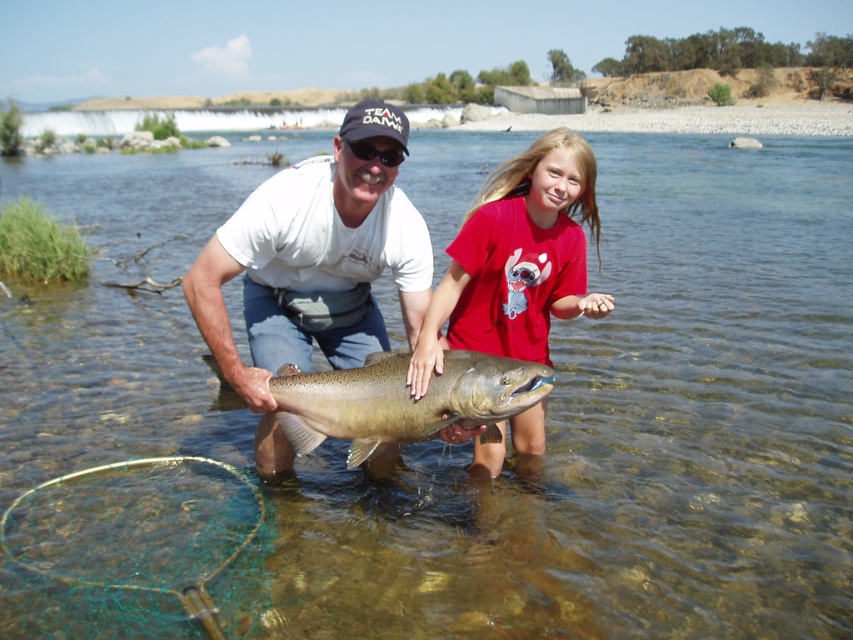
Does matte white shirt at center have a greater height compared to shiny silver fish at center?

Indeed, matte white shirt at center has a greater height compared to shiny silver fish at center.

Is matte white shirt at center positioned behind shiny silver fish at center?

Yes, matte white shirt at center is further from the viewer.

Does point (378, 323) come closer to viewer compared to point (372, 420)?

No, (378, 323) is further to viewer.

Where is `matte white shirt at center`? matte white shirt at center is located at coordinates (314, 266).

Who is shorter, matte red t-shirt at center or shiny silver fish at center?

With less height is shiny silver fish at center.

From the picture: Who is lower down, matte red t-shirt at center or shiny silver fish at center?

shiny silver fish at center is lower down.

Describe the element at coordinates (517, 259) in the screenshot. The height and width of the screenshot is (640, 853). I see `matte red t-shirt at center` at that location.

Find the location of a particular element. matte red t-shirt at center is located at coordinates (517, 259).

Does matte white shirt at center appear over matte red t-shirt at center?

Incorrect, matte white shirt at center is not positioned above matte red t-shirt at center.

Does matte white shirt at center have a smaller size compared to matte red t-shirt at center?

No, matte white shirt at center is not smaller than matte red t-shirt at center.

In order to click on matte white shirt at center in this screenshot , I will do `click(314, 266)`.